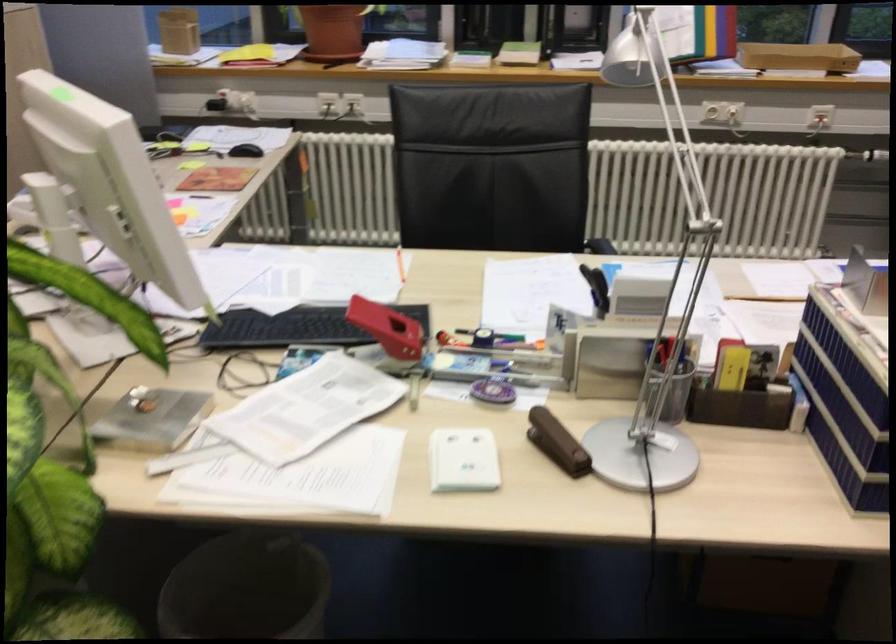
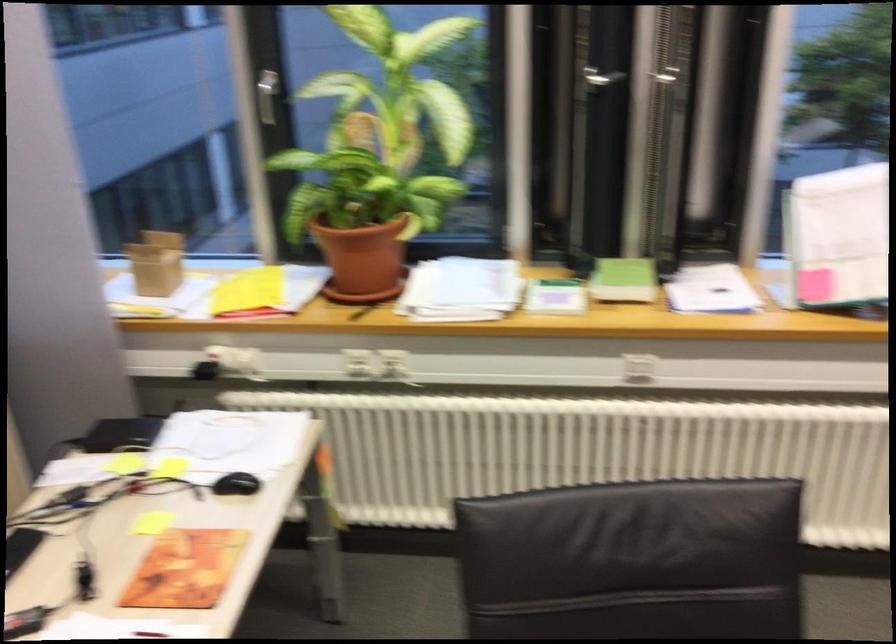
In the second image, find the point that corresponds to [211,180] in the first image.

(185, 569)